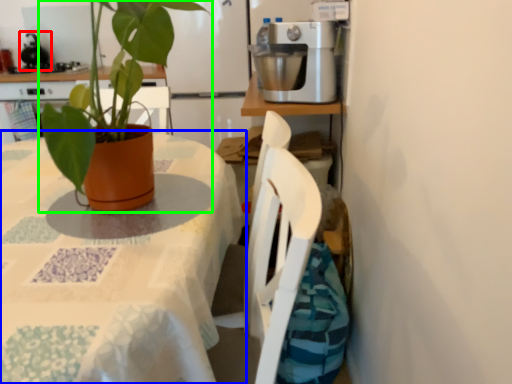
Question: Based on their relative distances, which object is farther from mixer (highlighted by a red box)? Choose from table (highlighted by a blue box) and houseplant (highlighted by a green box).

Choices:
 (A) table
 (B) houseplant

Answer: (B)